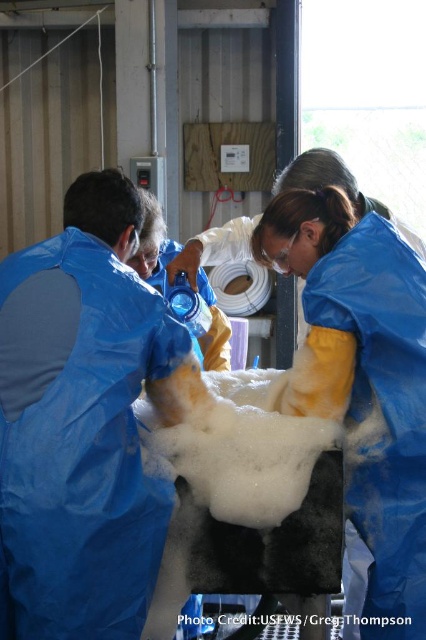
You are an observer in the lab and need to place a new equipment next to the blue protective suit at center. Where should you place it so it doesn not block the blue plastic bag at left?

Place the new equipment to the right of the blue protective suit at center so it doesn not block the blue plastic bag at left which is on the left side of the blue protective suit at center.

You are a worker in the lab and need to place a new blue plastic bag at left on a shelf next to the blue protective suit at center. Can you stack them vertically without the bag falling off?

The blue plastic bag at left is above the blue protective suit at center, so stacking them vertically would require placing the bag on top of the suit. However, since the bag is already positioned above the suit, it might already be in a stable position. Ensure the shelf can support the weight and balance to prevent the bag from falling.

You are a worker in the lab and need to move the blue plastic bag at left to a location 20 inches away from the blue protective suit at center. Is the current distance sufficient?

The blue plastic bag at left is currently 16.65 inches from the blue protective suit at center, which is less than the required 20 inches. Therefore, you need to move it further away to meet the distance requirement.